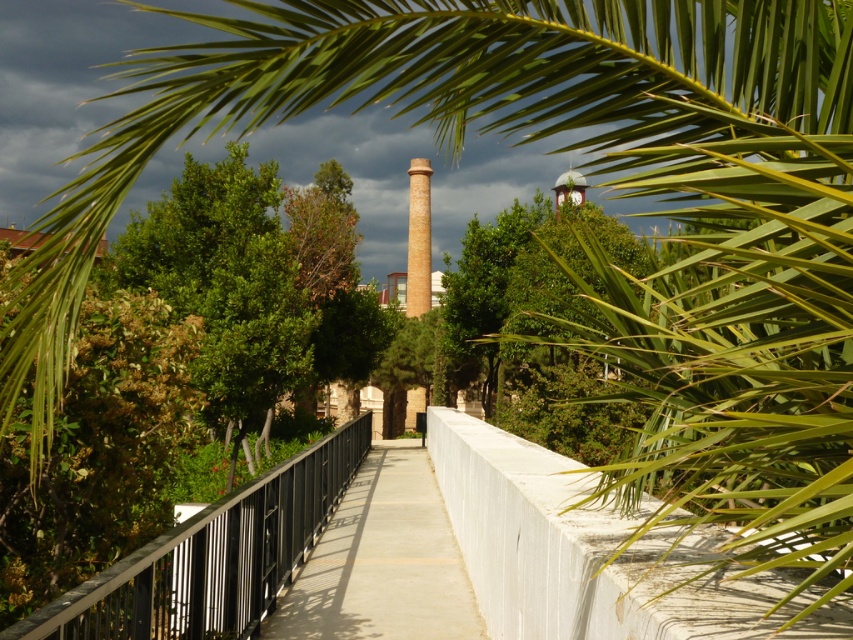
In the scene shown: You are a gardener planning to plant flowers along the pathway. You have two spots in mind near the black metal railing at center and the concrete sidewalk at center. Which spot is on the left side of the other?

The black metal railing at center is positioned on the left side of the concrete sidewalk at center, so the black metal railing at center is on the left side of the concrete sidewalk at center.

You are standing on the concrete sidewalk at center and want to reach the black metal railing at center. Which direction should you move to get closer to the railing?

Since the black metal railing at center is closer to the viewer than the concrete sidewalk at center, you should move forward towards the railing to reach it.